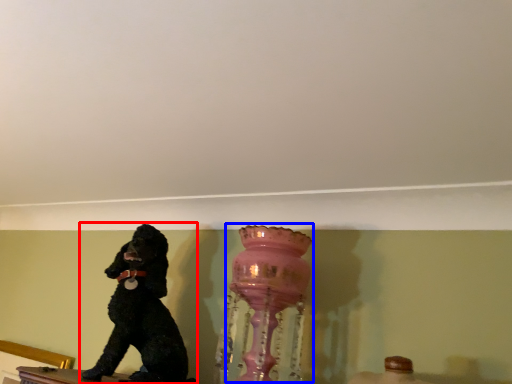
Question: Which object appears closest to the camera in this image, dog (highlighted by a red box) or vase (highlighted by a blue box)?

Choices:
 (A) dog
 (B) vase

Answer: (B)